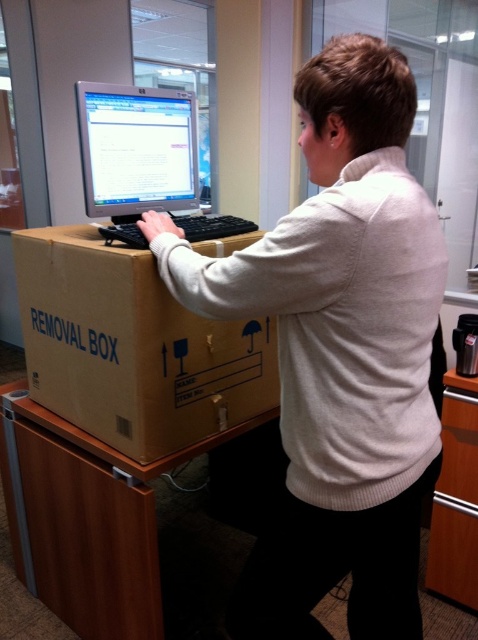
Where is the white sweater at center located in the image?

The white sweater at center is located at point coordinates of 0.552 on the x axis and 0.709 on the y axis.

You are a delivery person who just delivered a computer setup to an office. The computer setup includes a matte black monitor at center and a black plastic keyboard at center. The office requires that the distance between the monitor and keyboard must be at least 4 inches to comply with ergonomic standards. Can the current setup meet this requirement?

The matte black monitor at center is 3.86 inches from the black plastic keyboard at center. Since 3.86 inches is less than the required 4 inches, the current setup does not meet the ergonomic standard.

You are an office assistant who needs to move the white sweater at center and the matte black monitor at center to another room. The doorway you are using is 1.8 meters tall. Can both items pass through the doorway without bending or tilting them?

The white sweater at center is much taller than the matte black monitor at center. Since the doorway is 1.8 meters tall, both items can pass through as long as their heights are under 1.8 meters. However, since the sweater is taller than the monitor, we need to confirm the exact height of the sweater. If the sweater exceeds 1.8 meters when worn, it might not fit. But typically, a sweater doesn